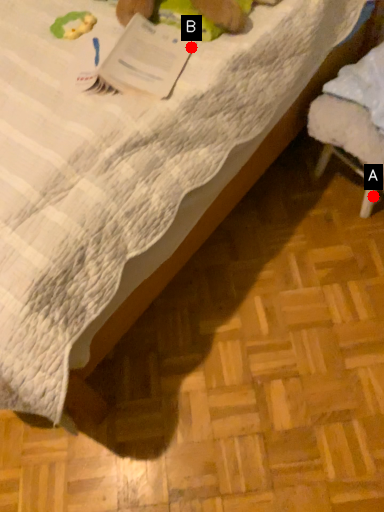
Question: Two points are circled on the image, labeled by A and B beside each circle. Which point is closer to the camera taking this photo?

Choices:
 (A) A is closer
 (B) B is closer

Answer: (B)